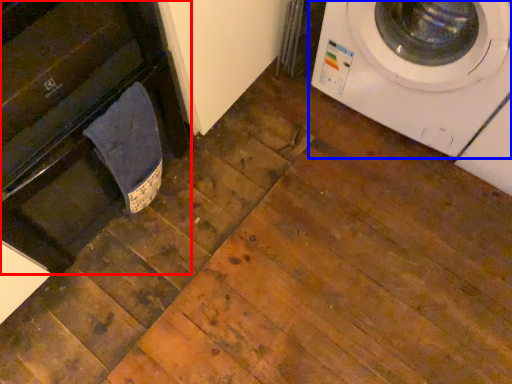
Question: Among these objects, which one is farthest to the camera, dish washer (highlighted by a red box) or washing machine (highlighted by a blue box)?

Choices:
 (A) dish washer
 (B) washing machine

Answer: (B)